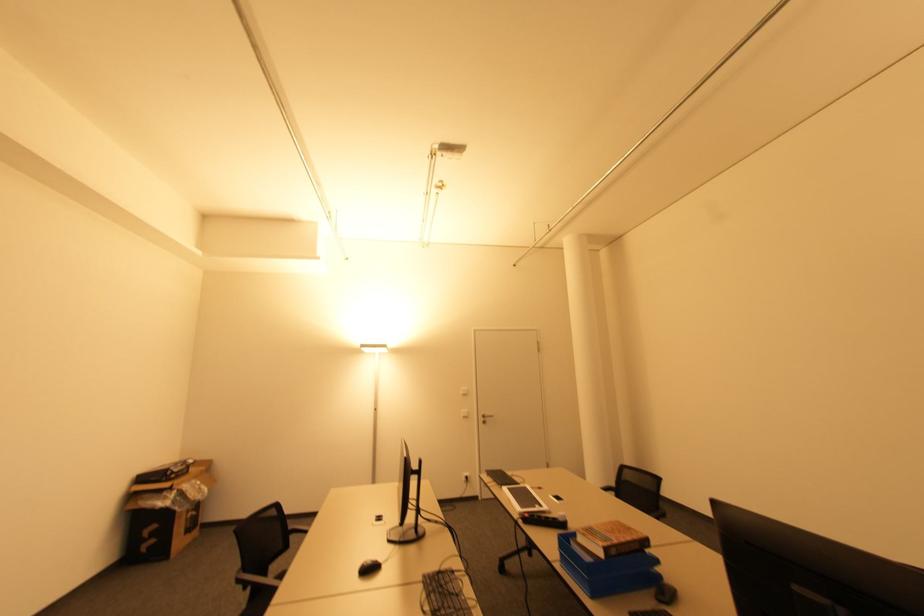
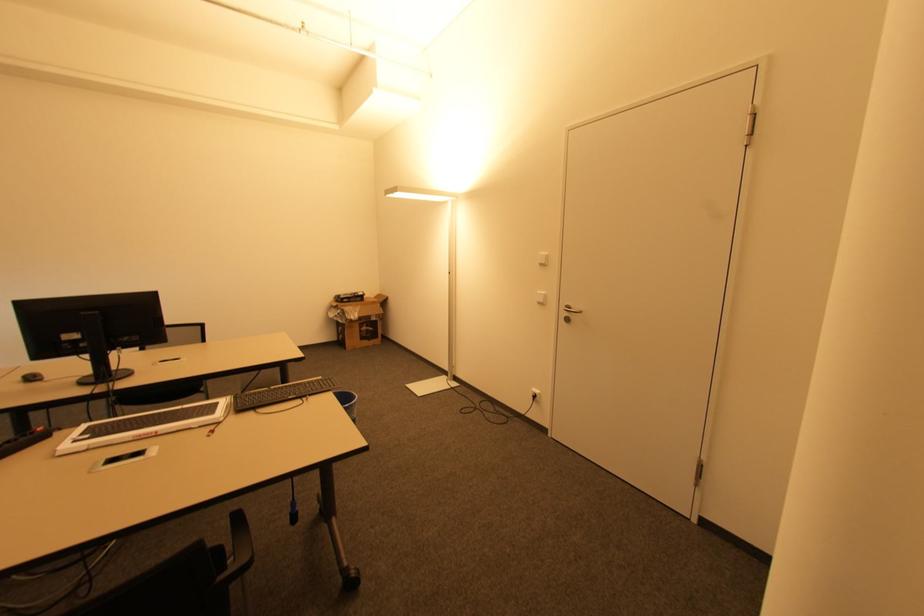
Where in the second image is the point corresponding to the point at 485,422 from the first image?

(568, 320)